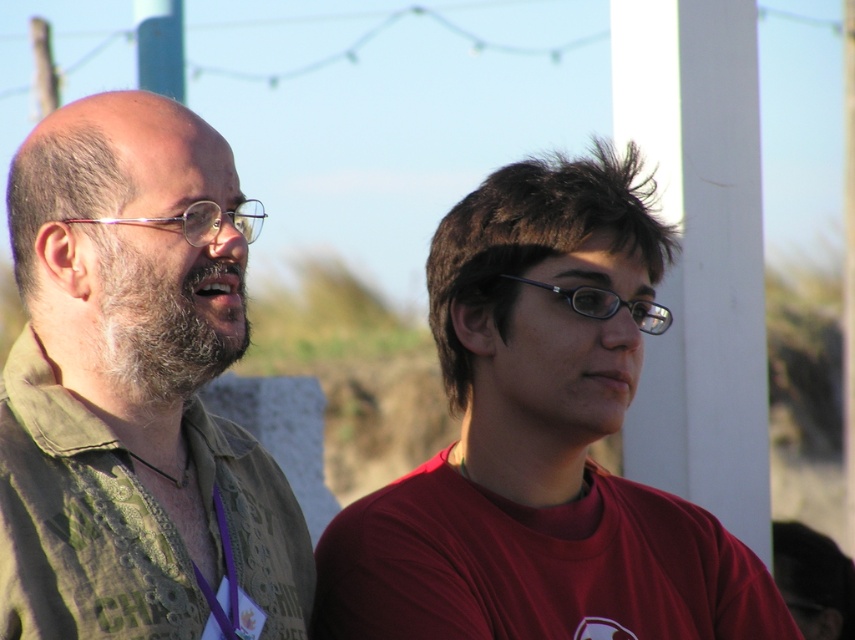
You are a photographer trying to capture a photo of the two people. You want to ensure that both the matte red shirt at center and the green textured shirt at left are clearly visible in the frame. Based on their positions, which shirt should you focus on first to ensure both are in focus?

The matte red shirt at center is located below the green textured shirt at left. To ensure both are in focus, you should focus on the green textured shirt at left first since it is higher in the frame, allowing the depth of field to naturally cover the lower positioned matte red shirt at center.